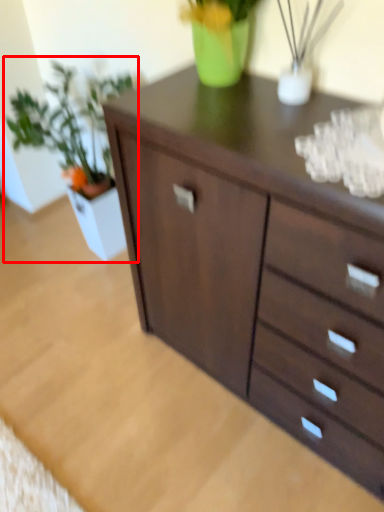
Question: From the image, what is the correct spatial relationship of houseplant (annotated by the red box) in relation to chest of drawers?

Choices:
 (A) left
 (B) right

Answer: (A)